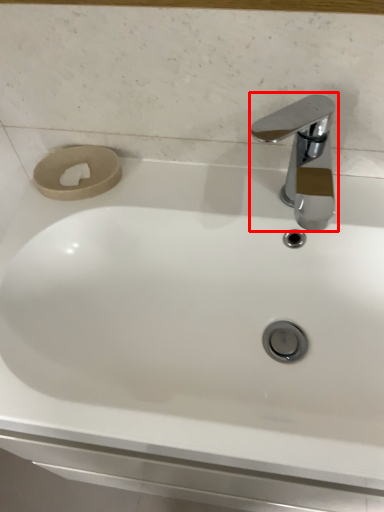
Question: From the image's perspective, where is tap (annotated by the red box) located relative to toilet paper?

Choices:
 (A) below
 (B) above

Answer: (A)